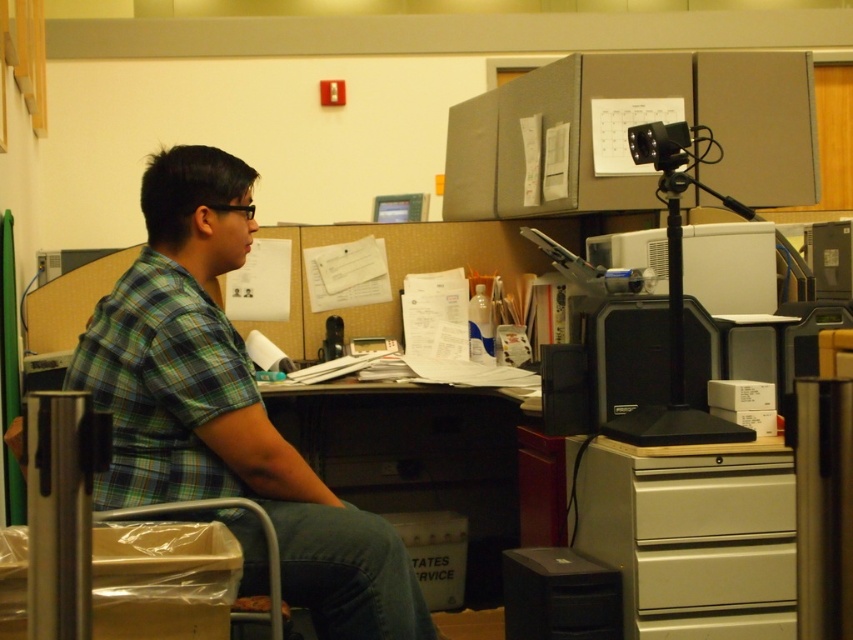
Can you confirm if metallic gray file cabinet at lower right is shorter than dark brown wood desk at center?

Yes, metallic gray file cabinet at lower right is shorter than dark brown wood desk at center.

Between point (750, 566) and point (496, 452), which one is positioned behind?

Positioned behind is point (496, 452).

This screenshot has height=640, width=853. I want to click on metallic gray file cabinet at lower right, so click(689, 534).

Which of these two, metallic gray file cabinet at lower right or metallic gray drawer at lower center, stands taller?

With more height is metallic gray file cabinet at lower right.

Who is positioned more to the right, metallic gray file cabinet at lower right or metallic gray drawer at lower center?

metallic gray drawer at lower center

Which is behind, point (688, 470) or point (675, 550)?

The point (675, 550) is behind.

Locate an element on the screen. metallic gray file cabinet at lower right is located at coordinates (689, 534).

Is metallic gray drawer at lower center to the left of beige plastic drawer at lower right from the viewer's perspective?

In fact, metallic gray drawer at lower center is to the right of beige plastic drawer at lower right.

Which is behind, point (640, 573) or point (660, 534)?

The point (660, 534) is behind.

Identify the location of metallic gray drawer at lower center. (714, 573).